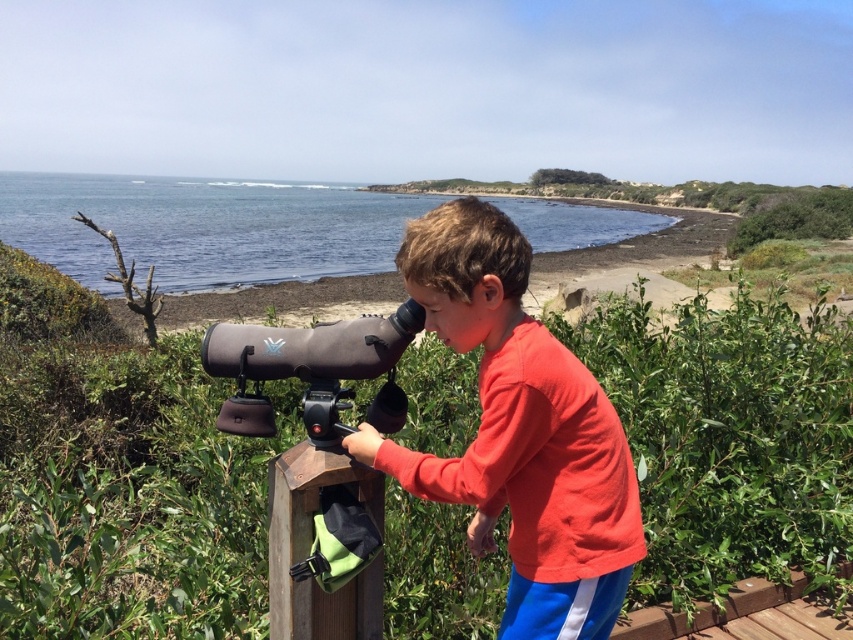
You are a photographer trying to capture the boy in the image. The boy is wearing a matte red shirt at center. To ensure the shirt is in focus, where should you aim your camera lens? Please provide coordinates in the format of a point like this example format point 0.677, 0.610.

The matte red shirt at center is located at point [519,433], so you should aim your camera lens at point [519,433] to ensure the shirt is in focus.

You are a photographer trying to capture the boy in the matte red shirt at center using the matte black telescope at center. Since the shirt and telescope are both at the center, which object should you focus on to ensure the boy is clearly visible in your photo?

The matte red shirt at center is in front of the matte black telescope at center, so focusing on the matte red shirt at center will ensure the boy is clearly visible.

You are a photographer trying to capture a closeup of the matte black telescope at center. You have a camera with a lens that can focus on objects within 30 centimeters. Are you able to take the photo without moving the matte red shirt at center?

The matte red shirt at center is 28.94 centimeters from the matte black telescope at center. Since the camera lens can focus within 30 centimeters, you can take the photo without moving the matte red shirt at center because the distance is within the focus range.